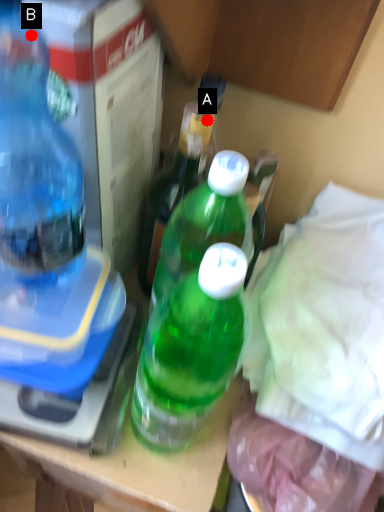
Question: Two points are circled on the image, labeled by A and B beside each circle. Which point is closer to the camera?

Choices:
 (A) A is closer
 (B) B is closer

Answer: (B)